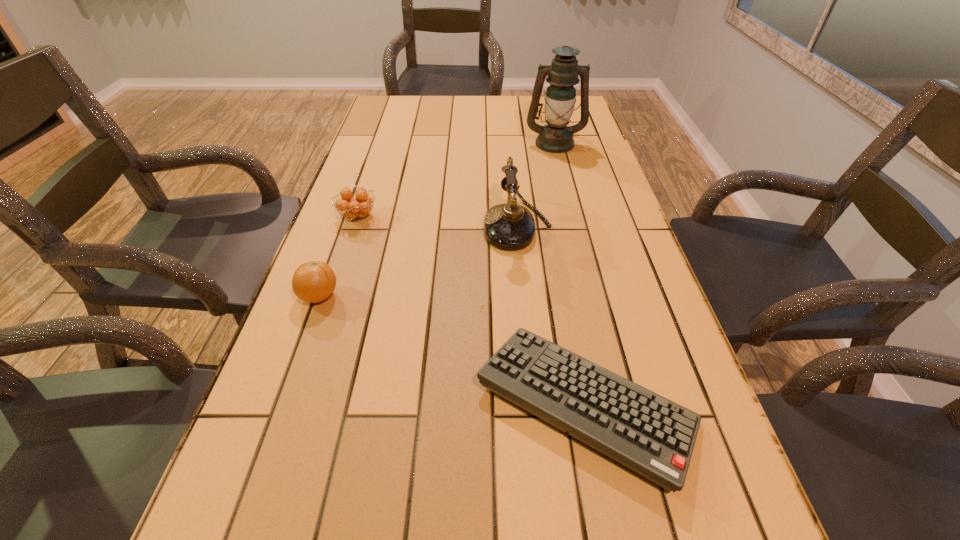
Locate an element on the screen. The width and height of the screenshot is (960, 540). object that is the closest to the nearer orange fruit is located at coordinates (356, 208).

At what (x,y) coordinates should I click in order to perform the action: click on object that is the closest one to the fourth shortest object. Please return your answer as a coordinate pair (x, y). This screenshot has width=960, height=540. Looking at the image, I should click on (642, 430).

The width and height of the screenshot is (960, 540). I want to click on free space that satisfies the following two spatial constraints: 1. on the dial of the telephone; 2. on the right side of the shortest object, so click(536, 404).

Identify the location of vacant area in the image that satisfies the following two spatial constraints: 1. on the back side of the fourth farthest object; 2. on the left side of the oil lamp. This screenshot has width=960, height=540. (374, 143).

At what (x,y) coordinates should I click in order to perform the action: click on vacant area that satisfies the following two spatial constraints: 1. on the dial of the telephone; 2. on the right side of the shortest object. Please return your answer as a coordinate pair (x, y). The width and height of the screenshot is (960, 540). Looking at the image, I should click on (536, 404).

Image resolution: width=960 pixels, height=540 pixels. Find the location of `blank area in the image that satisfies the following two spatial constraints: 1. on the dial of the computer keyboard; 2. on the left side of the fourth shortest object`. blank area in the image that satisfies the following two spatial constraints: 1. on the dial of the computer keyboard; 2. on the left side of the fourth shortest object is located at coordinates (536, 404).

Image resolution: width=960 pixels, height=540 pixels. Find the location of `vacant space that satisfies the following two spatial constraints: 1. on the back side of the farthest object; 2. on the right side of the computer keyboard`. vacant space that satisfies the following two spatial constraints: 1. on the back side of the farthest object; 2. on the right side of the computer keyboard is located at coordinates (535, 143).

The image size is (960, 540). What are the coordinates of `free space that satisfies the following two spatial constraints: 1. on the dial of the second tallest object; 2. on the right side of the shortest object` in the screenshot? It's located at (536, 404).

Find the location of a particular element. The width and height of the screenshot is (960, 540). free spot that satisfies the following two spatial constraints: 1. on the front side of the fourth farthest object; 2. on the left side of the computer keyboard is located at coordinates (280, 404).